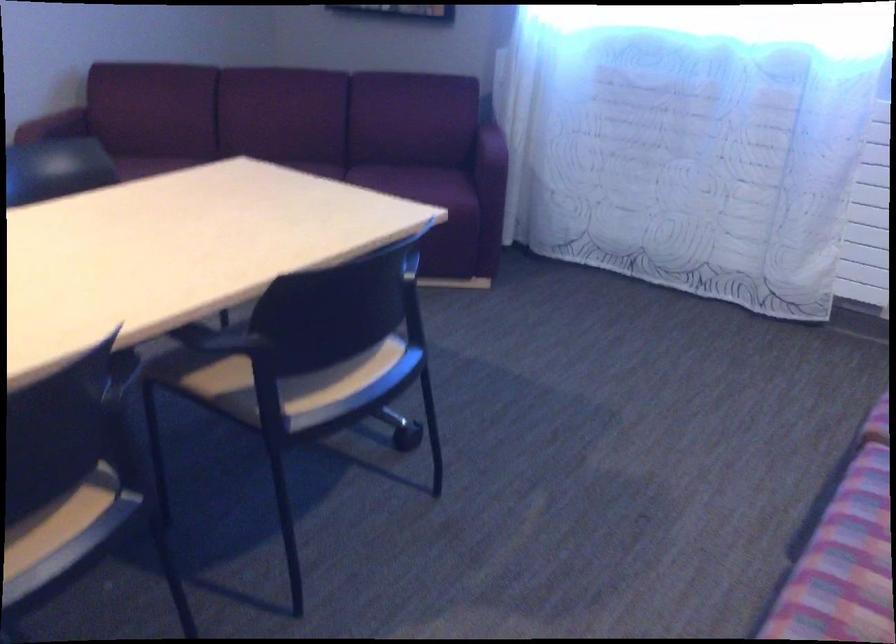
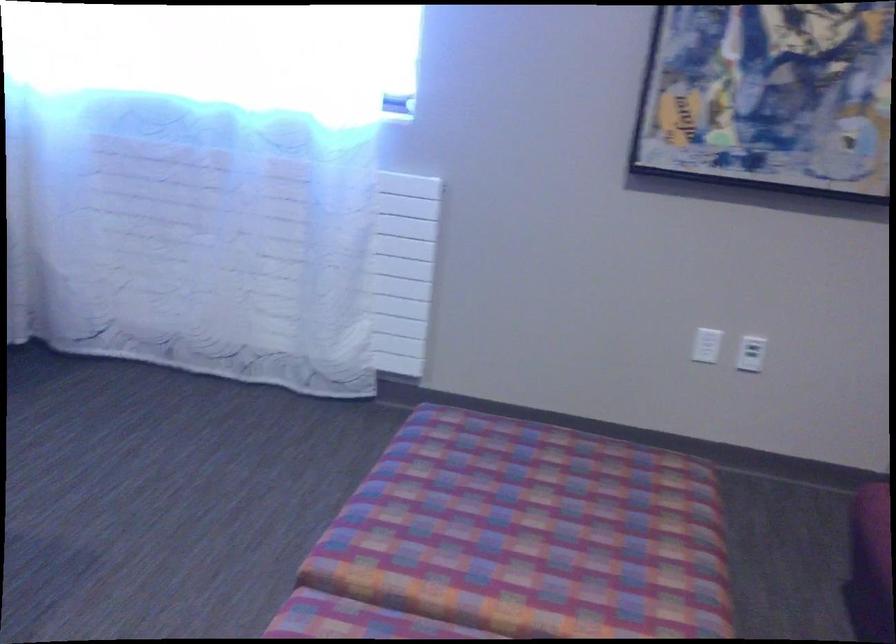
Question: Based on the continuous images, in which direction is the camera rotating? Reply with the corresponding letter.

Choices:
 (A) Left
 (B) Right
 (C) Up
 (D) Down

Answer: (B)